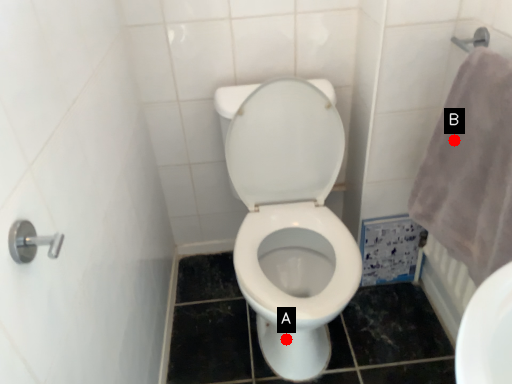
Question: Two points are circled on the image, labeled by A and B beside each circle. Which of the following is the farthest from the observer?

Choices:
 (A) A is further
 (B) B is further

Answer: (A)